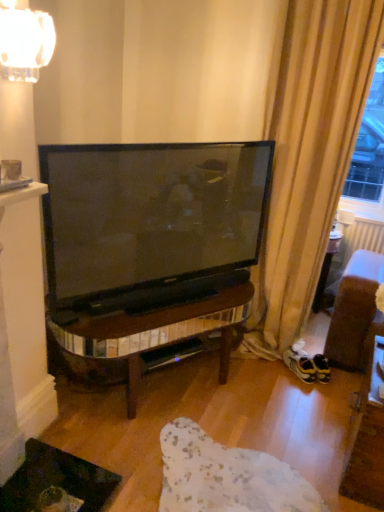
Question: Is matte white mug at upper left positioned beyond the bounds of yellow suede sneakers at lower right?

Choices:
 (A) yes
 (B) no

Answer: (A)

Question: Could you tell me if matte white mug at upper left is turned towards yellow suede sneakers at lower right?

Choices:
 (A) no
 (B) yes

Answer: (A)

Question: Is matte white mug at upper left to the left of yellow suede sneakers at lower right from the viewer's perspective?

Choices:
 (A) no
 (B) yes

Answer: (B)

Question: Is matte white mug at upper left in contact with yellow suede sneakers at lower right?

Choices:
 (A) no
 (B) yes

Answer: (A)

Question: Does matte white mug at upper left appear on the right side of yellow suede sneakers at lower right?

Choices:
 (A) no
 (B) yes

Answer: (A)

Question: From the image's perspective, is matte white mug at upper left on yellow suede sneakers at lower right?

Choices:
 (A) yes
 (B) no

Answer: (A)

Question: Does matte white mug at upper left appear on the left side of clear glass lampshade at upper left?

Choices:
 (A) no
 (B) yes

Answer: (B)

Question: Can you confirm if matte white mug at upper left is taller than clear glass lampshade at upper left?

Choices:
 (A) no
 (B) yes

Answer: (A)

Question: Are matte white mug at upper left and clear glass lampshade at upper left making contact?

Choices:
 (A) yes
 (B) no

Answer: (B)

Question: Is matte white mug at upper left smaller than clear glass lampshade at upper left?

Choices:
 (A) yes
 (B) no

Answer: (A)

Question: Does matte white mug at upper left lie behind clear glass lampshade at upper left?

Choices:
 (A) no
 (B) yes

Answer: (B)

Question: From a real-world perspective, is matte white mug at upper left physically above clear glass lampshade at upper left?

Choices:
 (A) yes
 (B) no

Answer: (B)

Question: Would you say clear glass lampshade at upper left is a long distance from yellow suede sneakers at lower right?

Choices:
 (A) no
 (B) yes

Answer: (B)